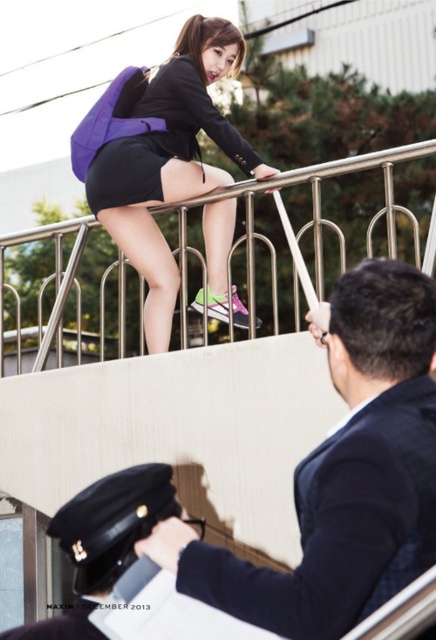
From the picture: You are a security guard on duty and notice two items at the upper center of the scene. The items are the black leather cap at upper center and the matte black blazer at upper center. Based on their positions, which item is closer to the ground?

The black leather cap at upper center is closer to the ground since it has a lesser height compared to the matte black blazer at upper center.

You are a security guard on duty and notice two items at the upper center of the scene. The items are the matte purple backpack at upper center and the black leather cap at upper center. According to the scene, which item is located above the other?

The matte purple backpack at upper center is positioned over the black leather cap at upper center, so it is above the cap.

Looking at this image, you are a security guard on the bridge. You notice two items at the upper center of your view. One is the black leather cap at upper center and the other is the matte black blazer at upper center. Which item is positioned more to the left?

The black leather cap at upper center is positioned more to the left than the matte black blazer at upper center.